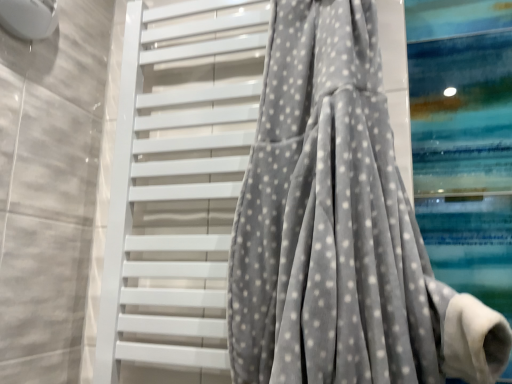
Where is `gray velvety curtain at center`? gray velvety curtain at center is located at coordinates (339, 228).

Measure the distance between point (x=364, y=1) and camera.

Point (x=364, y=1) is 75.00 centimeters from camera.

This screenshot has width=512, height=384. What do you see at coordinates (339, 228) in the screenshot?
I see `gray velvety curtain at center` at bounding box center [339, 228].

This screenshot has height=384, width=512. Describe the element at coordinates (178, 187) in the screenshot. I see `white matte towel rack at center` at that location.

In order to face white matte towel rack at center, should I rotate leftwards or rightwards?

Rotate left and turn 3.846 degrees.

At what (x,y) coordinates should I click in order to perform the action: click on white matte towel rack at center. Please return your answer as a coordinate pair (x, y). This screenshot has height=384, width=512. Looking at the image, I should click on (178, 187).

You are a GUI agent. You are given a task and a screenshot of the screen. Output one action in this format:
    pyautogui.click(x=<x>, y=<y>)
    Task: Click on the gray velvety curtain at center
    Image resolution: width=512 pixels, height=384 pixels.
    Given the screenshot: What is the action you would take?
    pyautogui.click(x=339, y=228)

Considering the relative positions of white matte towel rack at center and gray velvety curtain at center in the image provided, is white matte towel rack at center to the left of gray velvety curtain at center from the viewer's perspective?

Yes, white matte towel rack at center is to the left of gray velvety curtain at center.

Is the depth of white matte towel rack at center less than that of gray velvety curtain at center?

No, white matte towel rack at center is further to the viewer.

Does point (220, 326) lie behind point (448, 350)?

Yes, point (220, 326) is behind point (448, 350).

From the image's perspective, is white matte towel rack at center located beneath gray velvety curtain at center?

Yes.

From a real-world perspective, is white matte towel rack at center positioned above or below gray velvety curtain at center?

From a real-world perspective, white matte towel rack at center is physically above gray velvety curtain at center.

Considering the sizes of objects white matte towel rack at center and gray velvety curtain at center in the image provided, who is wider, white matte towel rack at center or gray velvety curtain at center?

Wider between the two is gray velvety curtain at center.

Which of these two, white matte towel rack at center or gray velvety curtain at center, stands shorter?

gray velvety curtain at center is shorter.

In terms of size, does white matte towel rack at center appear bigger or smaller than gray velvety curtain at center?

In the image, white matte towel rack at center appears to be smaller than gray velvety curtain at center.

Is white matte towel rack at center inside the boundaries of gray velvety curtain at center, or outside?

white matte towel rack at center cannot be found inside gray velvety curtain at center.

Is white matte towel rack at center with gray velvety curtain at center?

No, white matte towel rack at center is not touching gray velvety curtain at center.

Is white matte towel rack at center turned away from gray velvety curtain at center?

Absolutely, white matte towel rack at center is directed away from gray velvety curtain at center.

What's the angular difference between white matte towel rack at center and gray velvety curtain at center's facing directions?

The angular difference between white matte towel rack at center and gray velvety curtain at center is 0.00421 degrees.

Where is `shutter located below the gray velvety curtain at center (from the image's perspective)`? shutter located below the gray velvety curtain at center (from the image's perspective) is located at coordinates (178, 187).

Can you confirm if gray velvety curtain at center is positioned to the left of white matte towel rack at center?

In fact, gray velvety curtain at center is to the right of white matte towel rack at center.

Is gray velvety curtain at center in front of or behind white matte towel rack at center in the image?

Visually, gray velvety curtain at center is located in front of white matte towel rack at center.

Considering the positions of point (389, 291) and point (226, 236), is point (389, 291) closer or farther from the camera than point (226, 236)?

Point (389, 291) is closer to the camera than point (226, 236).

From the image's perspective, which one is positioned lower, gray velvety curtain at center or white matte towel rack at center?

white matte towel rack at center is shown below in the image.

From a real-world perspective, is gray velvety curtain at center on white matte towel rack at center?

Incorrect, from a real-world perspective, gray velvety curtain at center is lower than white matte towel rack at center.

Is gray velvety curtain at center wider than white matte towel rack at center?

Correct, the width of gray velvety curtain at center exceeds that of white matte towel rack at center.

From their relative heights in the image, would you say gray velvety curtain at center is taller or shorter than white matte towel rack at center?

Clearly, gray velvety curtain at center is shorter compared to white matte towel rack at center.

Based on their sizes in the image, would you say gray velvety curtain at center is bigger or smaller than white matte towel rack at center?

Clearly, gray velvety curtain at center is larger in size than white matte towel rack at center.

Is white matte towel rack at center inside gray velvety curtain at center?

That's incorrect, white matte towel rack at center is not inside gray velvety curtain at center.

Is gray velvety curtain at center beside white matte towel rack at center?

No, gray velvety curtain at center is not in contact with white matte towel rack at center.

Is gray velvety curtain at center facing away from white matte towel rack at center?

Absolutely, gray velvety curtain at center is directed away from white matte towel rack at center.

Can you tell me how much gray velvety curtain at center and white matte towel rack at center differ in facing direction?

gray velvety curtain at center and white matte towel rack at center are facing 0.00421 degrees away from each other.

Measure the distance between gray velvety curtain at center and white matte towel rack at center.

gray velvety curtain at center is 7.56 inches from white matte towel rack at center.

I want to click on shutter on the left of gray velvety curtain at center, so click(178, 187).

The height and width of the screenshot is (384, 512). Find the location of `curtain above the white matte towel rack at center (from the image's perspective)`. curtain above the white matte towel rack at center (from the image's perspective) is located at coordinates (339, 228).

Where is `curtain below the white matte towel rack at center (from a real-world perspective)`? curtain below the white matte towel rack at center (from a real-world perspective) is located at coordinates (339, 228).